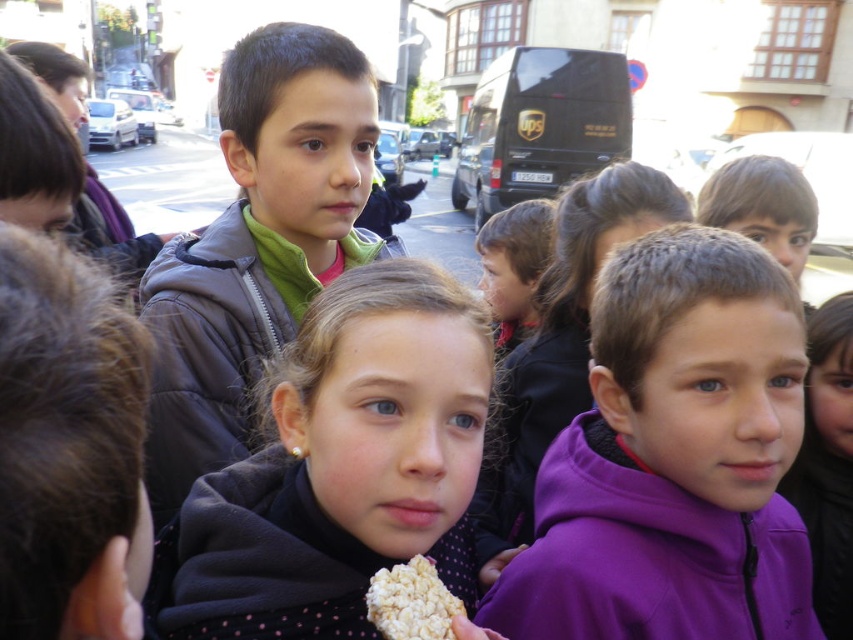
You are a photographer trying to capture a group photo of the purple fleece jacket at center and the matte gray jacket at center. If the camera frame can only accommodate one of them, which jacket should you focus on to ensure it fits entirely within the frame?

The purple fleece jacket at center might be wider than matte gray jacket at center, so you should focus on the purple fleece jacket at center to ensure it fits entirely within the frame.

You are a photographer trying to capture both the dark gray fleece jacket at center and the matte gray jacket at center in a single frame. Based on their positions, will you need to adjust your camera angle to ensure both are fully visible?

The dark gray fleece jacket at center might be wider than matte gray jacket at center, so you may need to adjust your camera angle to ensure both are fully visible in the frame.

You are standing in the street scene and want to place a small flag at the point closer to the camera between point (454, 509) and point (334, 182). Which point should you choose?

You should choose point (454, 509) because it is closer to the camera than point (334, 182) according to the description.